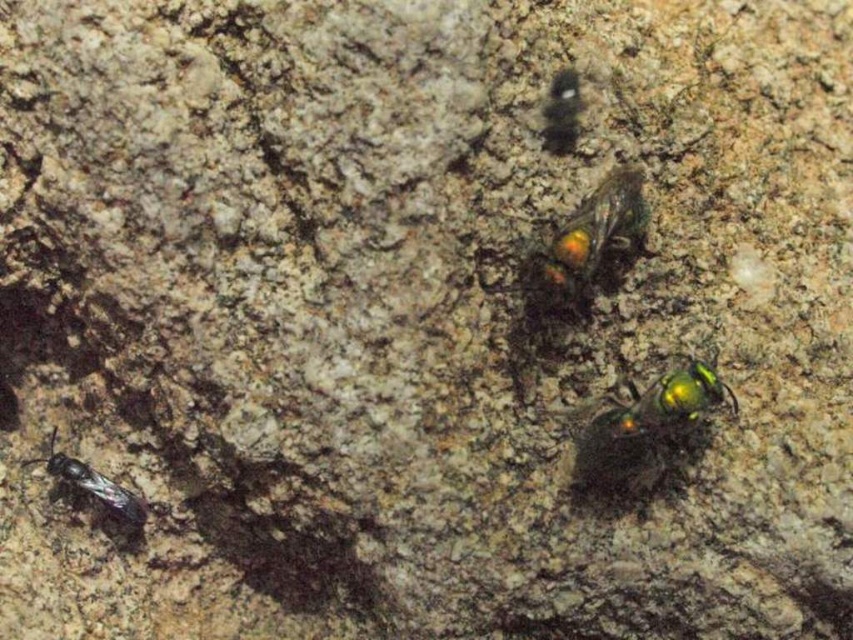
Looking at this image, which is more to the right, metallic green bee at center or shiny metallic bee at lower left?

Positioned to the right is metallic green bee at center.

Which is behind, point (607, 422) or point (134, 516)?

The point (134, 516) is behind.

Does point (677, 420) come behind point (137, 518)?

No, it is not.

In order to click on metallic green bee at center in this screenshot , I will do `click(647, 428)`.

How far apart are metallic green bee at center and metallic green beetle at center?

metallic green bee at center is 11.29 centimeters from metallic green beetle at center.

Does metallic green bee at center come behind metallic green beetle at center?

No, metallic green bee at center is closer to the viewer.

Describe the element at coordinates (647, 428) in the screenshot. The image size is (853, 640). I see `metallic green bee at center` at that location.

I want to click on metallic green bee at center, so click(x=647, y=428).

Is the position of metallic green beetle at center more distant than that of shiny metallic bee at lower left?

No.

In the scene shown: Can you confirm if metallic green beetle at center is thinner than shiny metallic bee at lower left?

Correct, metallic green beetle at center's width is less than shiny metallic bee at lower left's.

Which is in front, point (583, 284) or point (55, 461)?

Positioned in front is point (583, 284).

Locate an element on the screen. The height and width of the screenshot is (640, 853). metallic green beetle at center is located at coordinates (589, 246).